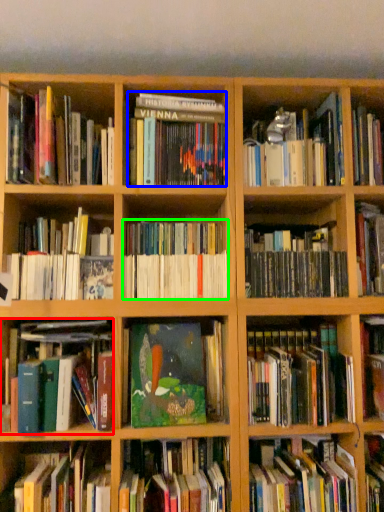
Question: Which object is the farthest from book (highlighted by a red box)? Choose among these: book (highlighted by a blue box) or book (highlighted by a green box).

Choices:
 (A) book
 (B) book

Answer: (A)